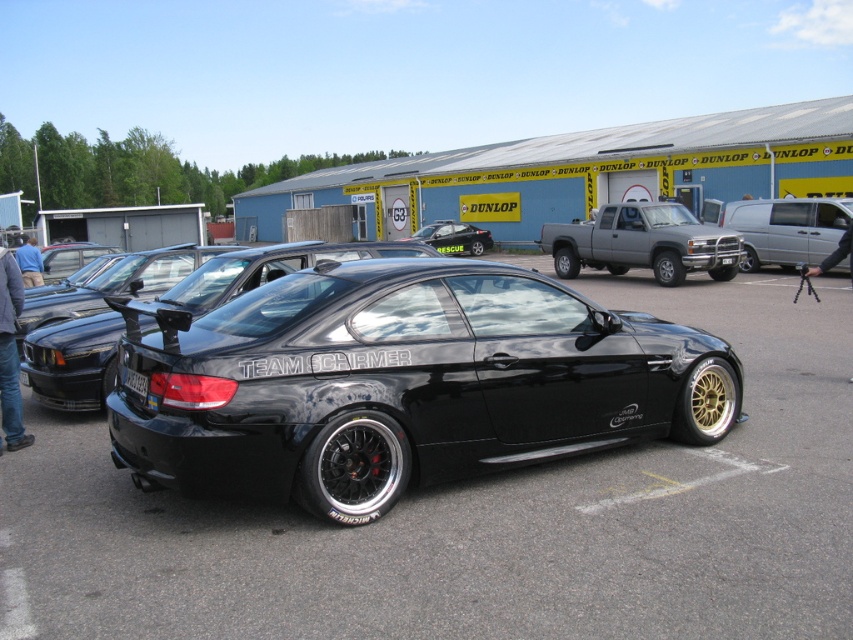
Question: Can you confirm if black matte/satin car at center is positioned to the right of black matte car at center?

Choices:
 (A) yes
 (B) no

Answer: (A)

Question: Which object appears closest to the camera in this image?

Choices:
 (A) black plastic license plate at center
 (B) black plastic license plate at rear
 (C) matte gray truck at center

Answer: (B)

Question: Does silver metallic van at right have a lesser width compared to black plastic license plate at rear?

Choices:
 (A) no
 (B) yes

Answer: (A)

Question: Among these points, which one is nearest to the camera?

Choices:
 (A) (248, 268)
 (B) (436, 248)
 (C) (807, 243)
 (D) (666, 240)

Answer: (A)

Question: Which point is closer to the camera taking this photo?

Choices:
 (A) (805, 262)
 (B) (62, 376)
 (C) (422, 236)

Answer: (B)

Question: Can you confirm if black matte/satin car at center is wider than matte gray truck at center?

Choices:
 (A) no
 (B) yes

Answer: (B)